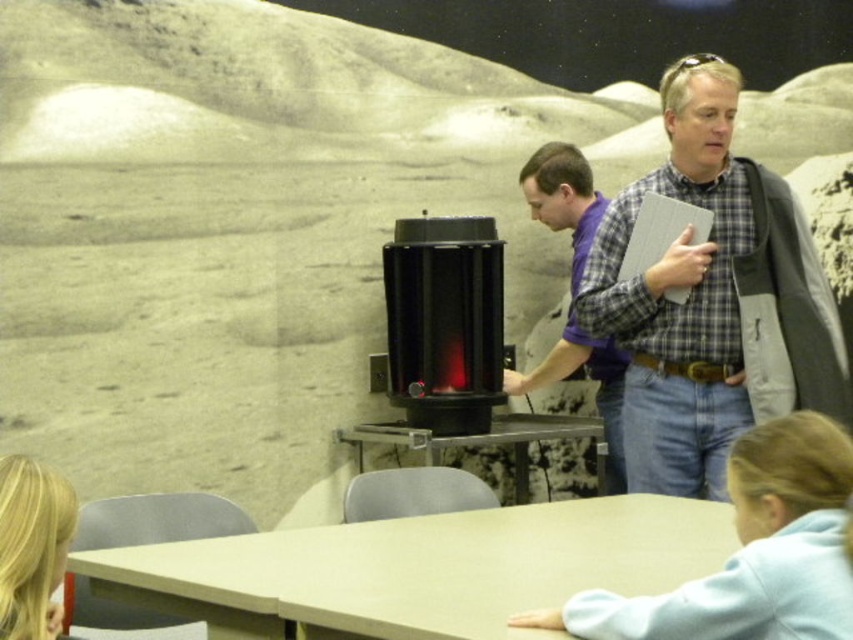
Can you confirm if blonde hair at lower left is positioned below smooth gray table at center?

No, blonde hair at lower left is not below smooth gray table at center.

Who is more forward, (49, 566) or (427, 452)?

Point (49, 566) is more forward.

Where is `blonde hair at lower left`? The height and width of the screenshot is (640, 853). blonde hair at lower left is located at coordinates (32, 547).

Does light blue fleece at lower right have a lesser height compared to purple plaid shirt at center?

Correct, light blue fleece at lower right is not as tall as purple plaid shirt at center.

Which is more to the right, light blue fleece at lower right or purple plaid shirt at center?

Answer: light blue fleece at lower right is more to the right.

Does point (735, 520) come behind point (622, 481)?

No, it is in front of (622, 481).

Identify the location of light blue fleece at lower right. (751, 552).

Does plaid shirt at upper right lie behind purple plaid shirt at center?

No, plaid shirt at upper right is closer to the viewer.

Is plaid shirt at upper right below purple plaid shirt at center?

Actually, plaid shirt at upper right is above purple plaid shirt at center.

Identify the location of plaid shirt at upper right. (712, 300).

Locate an element on the screen. plaid shirt at upper right is located at coordinates (712, 300).